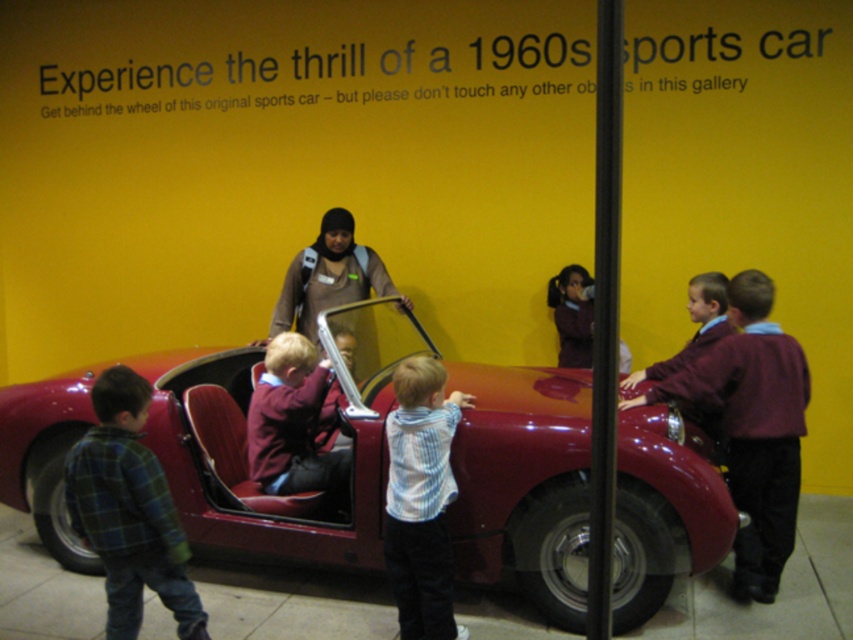
Question: Which object appears closest to the camera in this image?

Choices:
 (A) shiny red car at center
 (B) green plaid shirt at lower left
 (C) maroon fabric jacket at center

Answer: (B)

Question: Based on their relative distances, which object is farther from the maroon sweater at right?

Choices:
 (A) shiny red car at center
 (B) striped shirt at center

Answer: (A)

Question: Is striped shirt at center further to the viewer compared to maroon fabric jacket at center?

Choices:
 (A) no
 (B) yes

Answer: (A)

Question: Is maroon sweater at right to the left of striped shirt at center from the viewer's perspective?

Choices:
 (A) yes
 (B) no

Answer: (B)

Question: Among these points, which one is farthest from the camera?

Choices:
 (A) (299, 460)
 (B) (555, 568)

Answer: (A)

Question: Is green plaid shirt at lower left above maroon fabric jacket at center?

Choices:
 (A) yes
 (B) no

Answer: (B)